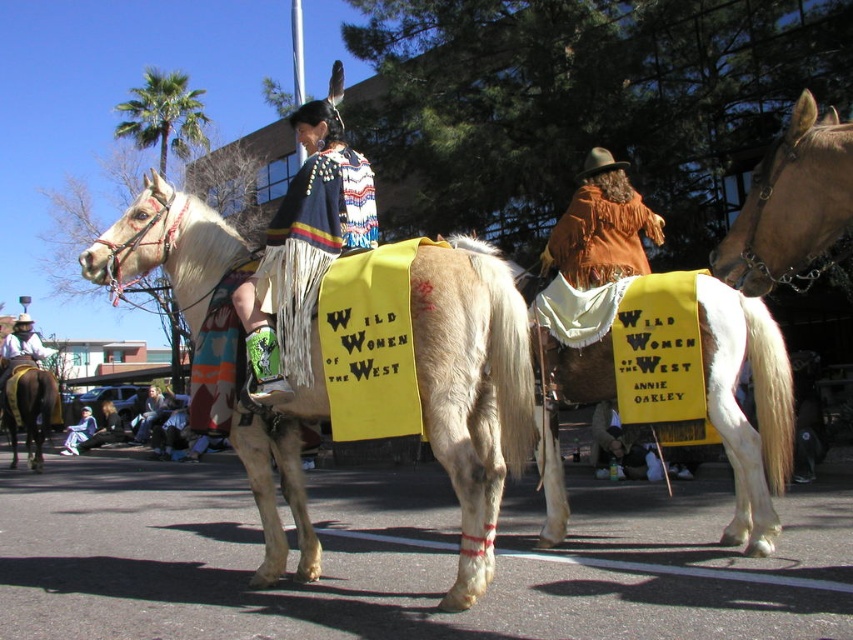
Consider the image. How much distance is there between brown fringed cape at center and denim jacket at lower left?

53.60 feet

Does brown fringed cape at center have a smaller size compared to denim jacket at lower left?

Indeed, brown fringed cape at center has a smaller size compared to denim jacket at lower left.

This screenshot has width=853, height=640. In order to click on brown fringed cape at center in this screenshot , I will do `click(601, 227)`.

Which is below, knitted wool poncho at center or light brown leather jacket at center?

light brown leather jacket at center is lower down.

Can you confirm if knitted wool poncho at center is positioned above light brown leather jacket at center?

Answer: Yes.

Does point (294, 384) come closer to viewer compared to point (135, 420)?

That is True.

Where is `knitted wool poncho at center`? This screenshot has width=853, height=640. knitted wool poncho at center is located at coordinates (305, 250).

Does white leather saddle at center appear on the right side of brown glossy horse at left?

Yes, white leather saddle at center is to the right of brown glossy horse at left.

Is white leather saddle at center positioned at the back of brown glossy horse at left?

No, white leather saddle at center is in front of brown glossy horse at left.

You are a GUI agent. You are given a task and a screenshot of the screen. Output one action in this format:
    pyautogui.click(x=<x>, y=<y>)
    Task: Click on the white leather saddle at center
    This screenshot has width=853, height=640.
    Given the screenshot: What is the action you would take?
    pyautogui.click(x=741, y=412)

Locate an element on the screen. white leather saddle at center is located at coordinates (741, 412).